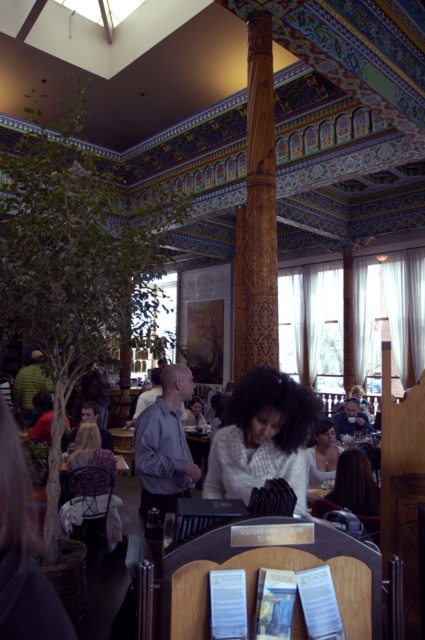
Is white matte dress at center further to camera compared to smooth white blouse at center?

No, it is not.

Where is `white matte dress at center`? white matte dress at center is located at coordinates (323, 456).

Which is behind, point (84, 484) or point (368, 499)?

Positioned behind is point (84, 484).

I want to click on matte black hair at center, so click(x=90, y=464).

From the picture: Who is more distant from viewer, (68, 516) or (317, 438)?

The point (317, 438) is more distant.

Between plaid fabric chair at lower left and white matte dress at center, which one is positioned lower?

plaid fabric chair at lower left

Image resolution: width=425 pixels, height=640 pixels. Identify the location of plaid fabric chair at lower left. (93, 508).